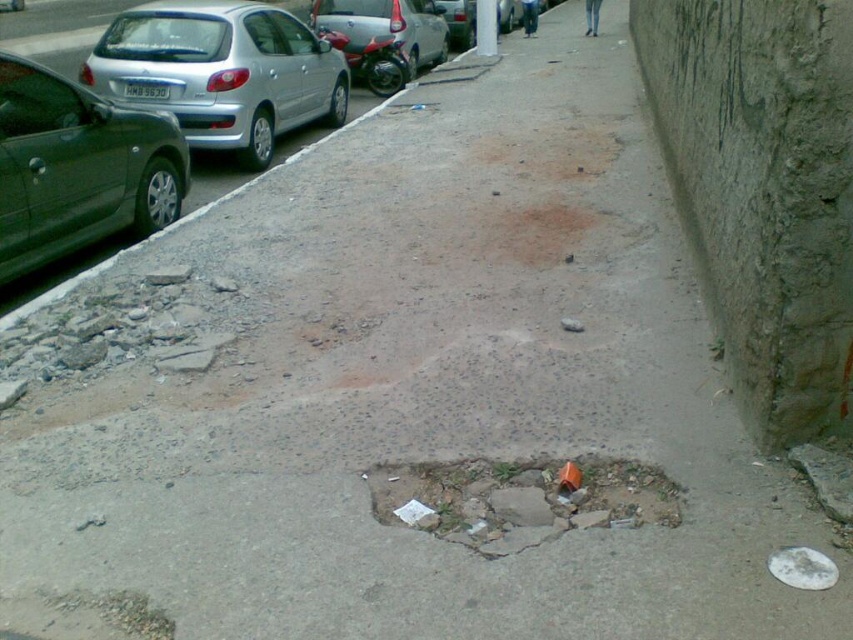
Is silver metallic hatchback at left smaller than silver metallic car at upper left?

No.

Who is positioned more to the right, silver metallic hatchback at left or silver metallic car at upper left?

silver metallic car at upper left is more to the right.

Does point (186, 97) come closer to viewer compared to point (337, 3)?

Yes, it is in front of point (337, 3).

The image size is (853, 640). I want to click on silver metallic hatchback at left, so click(221, 72).

Which is behind, point (172, 28) or point (48, 156)?

Point (172, 28)

Is silver metallic hatchback at left behind metallic green car at left?

Yes, silver metallic hatchback at left is further from the viewer.

Identify the location of silver metallic hatchback at left. click(221, 72).

Is metallic green car at left further to camera compared to cracked concrete hole at center?

Yes, metallic green car at left is further from the viewer.

Does point (96, 204) come farther from viewer compared to point (596, 461)?

Yes, point (96, 204) is farther from viewer.

Which is behind, point (126, 221) or point (456, 540)?

The point (126, 221) is more distant.

The width and height of the screenshot is (853, 640). I want to click on metallic green car at left, so click(78, 168).